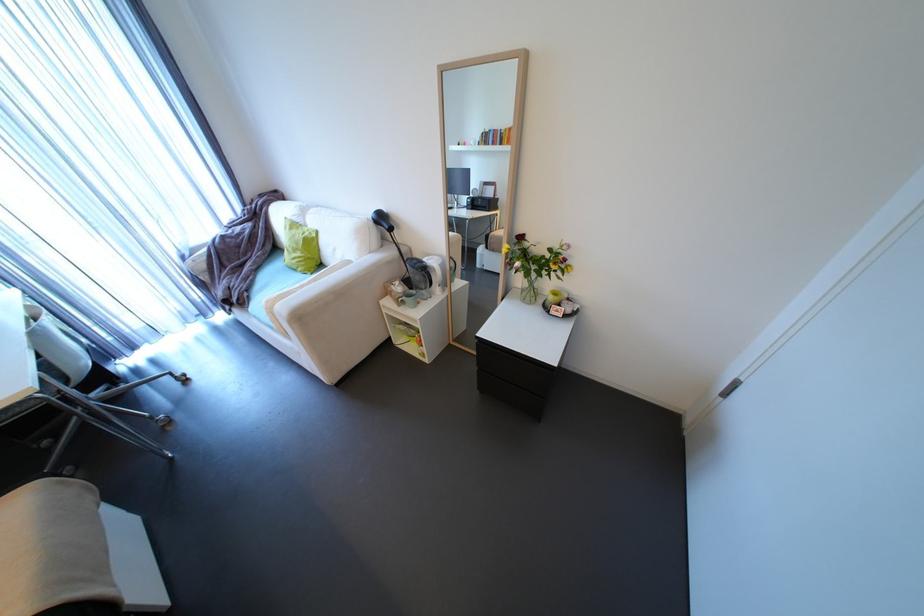
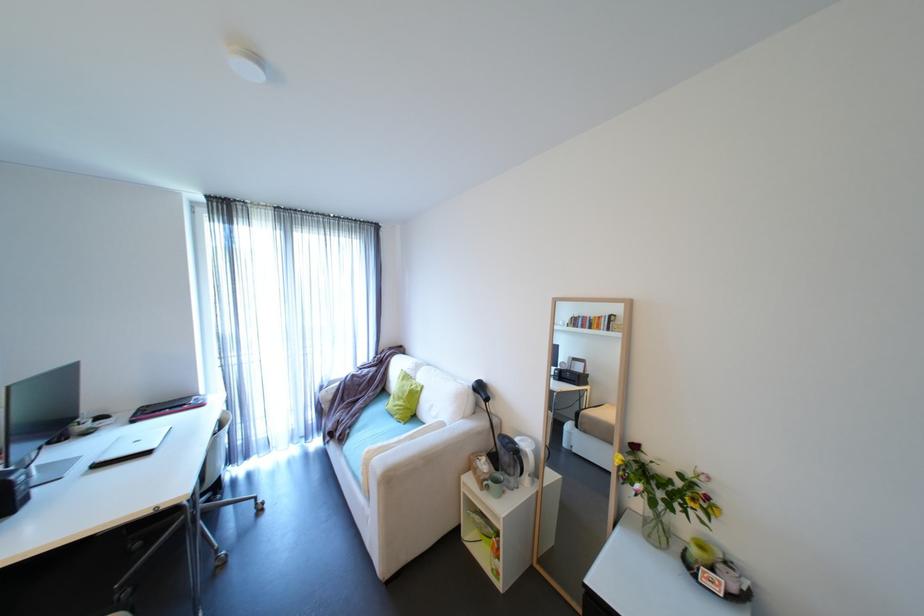
In the second image, find the point that corresponds to point 357,262 in the first image.

(450, 424)